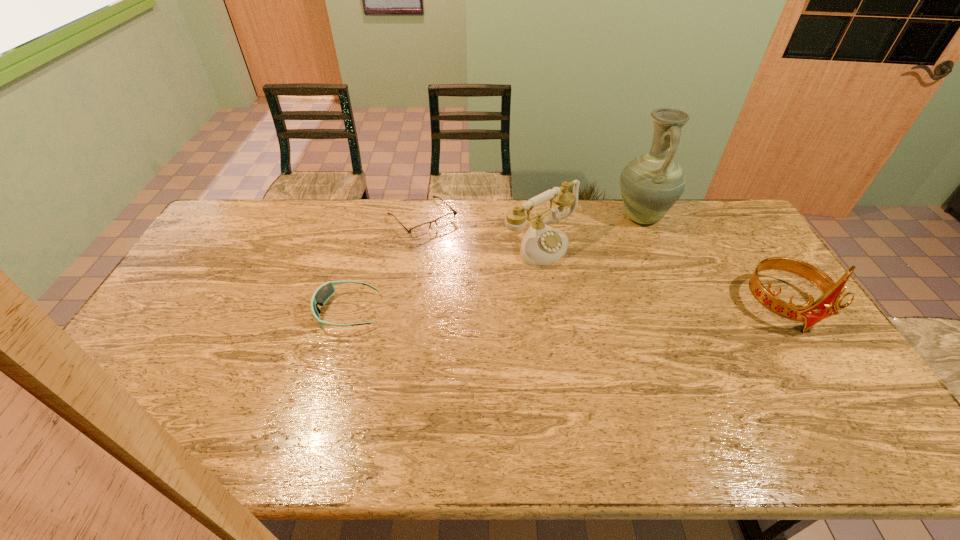
What are the coordinates of `the second shortest object` in the screenshot? It's located at (324, 292).

Locate an element on the screen. the rightmost object is located at coordinates (810, 313).

The image size is (960, 540). Identify the location of the fourth shortest object. (810, 313).

This screenshot has height=540, width=960. What are the coordinates of `the third shortest object` in the screenshot? It's located at (541, 245).

Locate an element on the screen. This screenshot has width=960, height=540. telephone is located at coordinates (541, 245).

In order to click on spectacles in this screenshot , I will do (x=446, y=219).

The width and height of the screenshot is (960, 540). Find the location of `the tallest object`. the tallest object is located at coordinates (650, 185).

I want to click on the second object from right to left, so click(x=650, y=185).

Where is `blank space located 0.090m on the front-facing side of the goggles`? The height and width of the screenshot is (540, 960). blank space located 0.090m on the front-facing side of the goggles is located at coordinates (286, 311).

I want to click on free region located 0.350m on the front-facing side of the goggles, so click(199, 311).